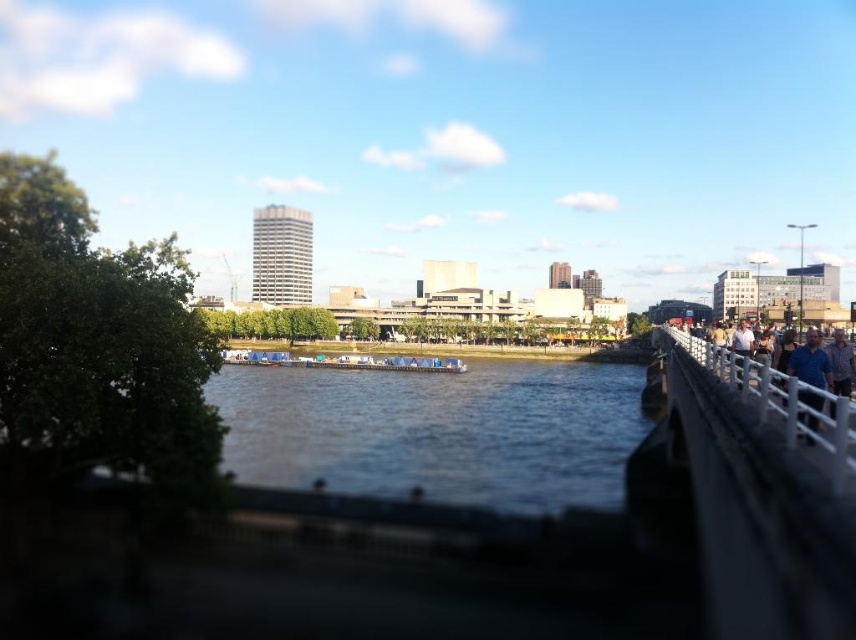
You are standing on the bridge and want to take a photo of both the white metal railing at right and the light brown wooden railing at right. Which railing should you focus on first if you want to capture them in the correct left to right order?

You should focus on the white metal railing at right first because it is positioned on the left side of the light brown wooden railing at right, so capturing them from left to right would start with the white metal one.

You are a painter setting up your easel on the bridge. You want to paint both the white metal railing at right and the light brown wooden railing at right. Which railing should you look up to paint?

The white metal railing at right has a greater height compared to the light brown wooden railing at right, so you should look up to paint the white metal railing at right.